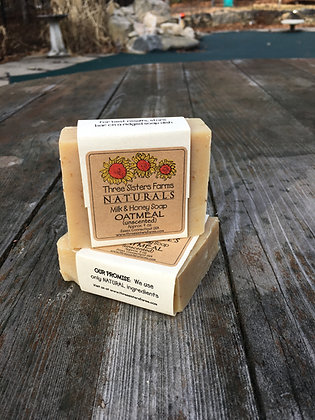
In order to click on wood planks in this screenshot , I will do `click(213, 363)`.